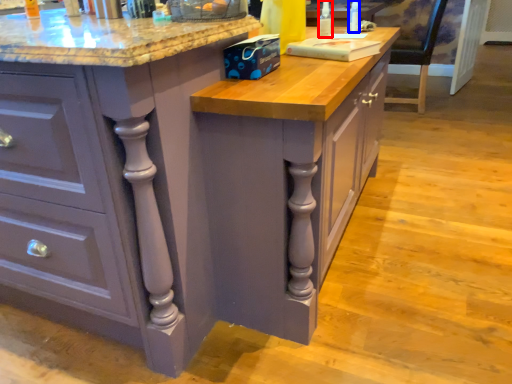
Question: Which of the following is the closest to the observer, bottle (highlighted by a red box) or bottle (highlighted by a blue box)?

Choices:
 (A) bottle
 (B) bottle

Answer: (A)